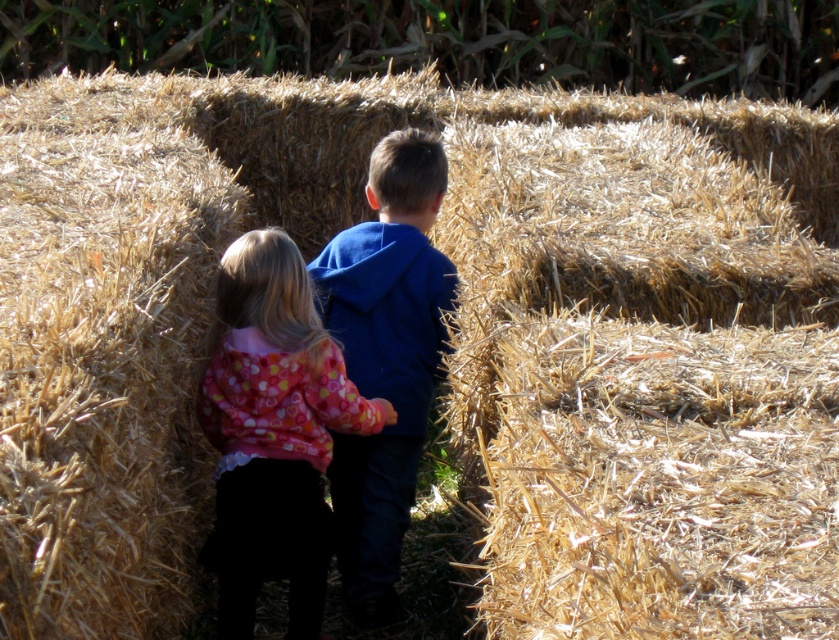
Can you confirm if floral fleece jacket at center is bigger than blue fleece jacket at center?

No, floral fleece jacket at center is not bigger than blue fleece jacket at center.

Describe the element at coordinates (274, 432) in the screenshot. I see `floral fleece jacket at center` at that location.

Locate an element on the screen. floral fleece jacket at center is located at coordinates (274, 432).